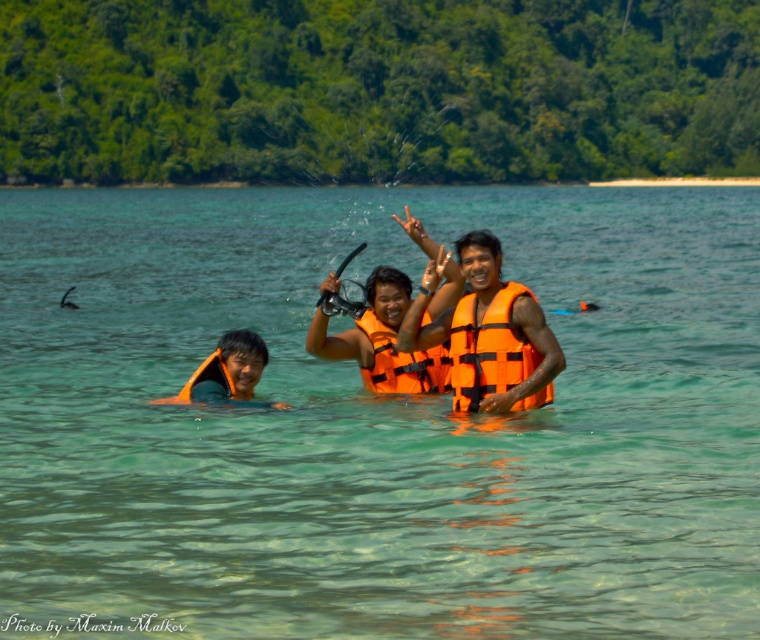
You are a lifeguard standing at the edge of the water. You need to locate the point at coordinates point (489, 337). Which object is this point located on?

The point (489, 337) is located on the orange life vest at center.

Where is the orange life vest at center located in the image?

The orange life vest at center is located at point (489, 337).

Consider the image. You are a lifeguard trying to ensure safety. You notice two orange life jackets in the water. The orange life vest at center and the orange matte life jacket at center. How far apart are they?

The distance between the orange life vest at center and the orange matte life jacket at center is 3.14 inches.